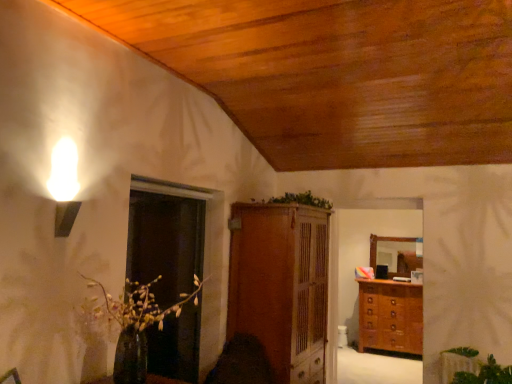
Question: From the image's perspective, is green leafy plant at center, which is counted as the second plant, starting from the front, below transparent glass door at center?

Choices:
 (A) yes
 (B) no

Answer: (B)

Question: Is green leafy plant at center, the first plant when ordered from left to right, outside of transparent glass door at center?

Choices:
 (A) no
 (B) yes

Answer: (B)

Question: Does green leafy plant at center, arranged as the 2th plant when viewed from the right, come behind transparent glass door at center?

Choices:
 (A) yes
 (B) no

Answer: (A)

Question: Are green leafy plant at center, arranged as the 2th plant when viewed from the right, and transparent glass door at center located far from each other?

Choices:
 (A) no
 (B) yes

Answer: (B)

Question: From a real-world perspective, is green leafy plant at center, which appears as the second plant when ordered from the bottom, beneath transparent glass door at center?

Choices:
 (A) yes
 (B) no

Answer: (B)

Question: Based on their positions, is wooden cabinet at center located to the left or right of transparent glass door at center?

Choices:
 (A) right
 (B) left

Answer: (A)

Question: Is wooden cabinet at center in front of or behind transparent glass door at center in the image?

Choices:
 (A) behind
 (B) front

Answer: (A)

Question: Does point tap(266, 349) appear closer or farther from the camera than point tap(184, 271)?

Choices:
 (A) closer
 (B) farther

Answer: (A)

Question: Is wooden cabinet at center wider or thinner than transparent glass door at center?

Choices:
 (A) wide
 (B) thin

Answer: (A)

Question: Does point (321, 307) appear closer or farther from the camera than point (467, 359)?

Choices:
 (A) closer
 (B) farther

Answer: (B)

Question: In terms of height, does wooden cabinet at center look taller or shorter compared to green leafy plant at lower right, which is the second plant in left-to-right order?

Choices:
 (A) tall
 (B) short

Answer: (A)

Question: In the image, is wooden cabinet at center positioned in front of or behind green leafy plant at lower right, which is the second plant in left-to-right order?

Choices:
 (A) front
 (B) behind

Answer: (B)

Question: From the image's perspective, is wooden cabinet at center positioned above or below green leafy plant at lower right, which is the second plant in left-to-right order?

Choices:
 (A) above
 (B) below

Answer: (A)

Question: In the image, is wooden chest of drawers at right positioned in front of or behind transparent glass door at center?

Choices:
 (A) front
 (B) behind

Answer: (B)

Question: Is wooden chest of drawers at right to the left or to the right of transparent glass door at center in the image?

Choices:
 (A) right
 (B) left

Answer: (A)